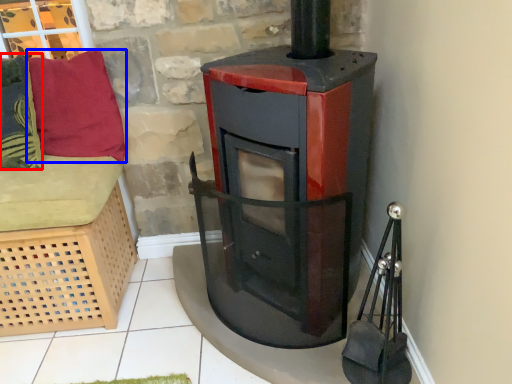
Question: Which point is closer to the camera, pillow (highlighted by a red box) or pillow (highlighted by a blue box)?

Choices:
 (A) pillow
 (B) pillow

Answer: (A)